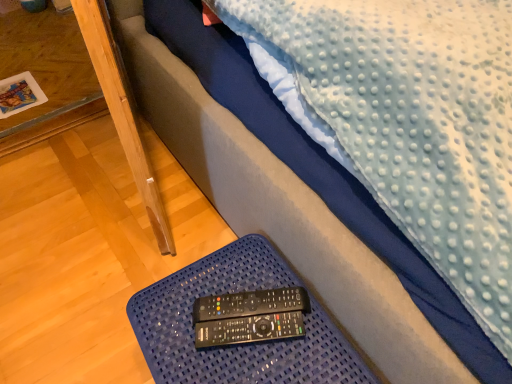
Where is `free point behind black plastic remote at lower center, which ranks as the 1th control in back-to-front order`? free point behind black plastic remote at lower center, which ranks as the 1th control in back-to-front order is located at coordinates (246, 265).